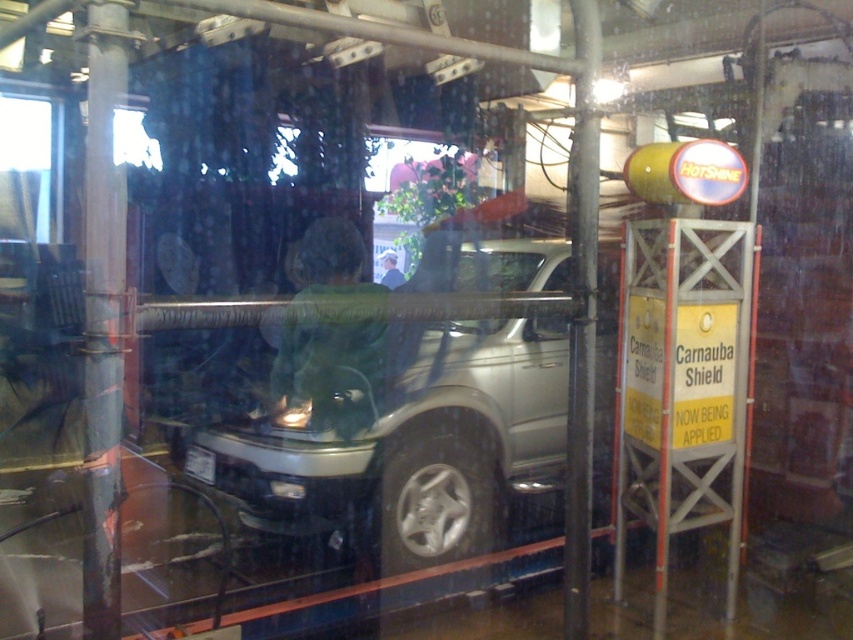
You are a delivery person with a box that is 4 meters long. You need to place the box between the green fabric shirt at center and the green fabric jacket at center. Is there enough space for the box to fit between them?

The distance between the green fabric shirt at center and the green fabric jacket at center is 3.86 meters. Since the box is 4 meters long, it is slightly too long to fit between them.

You are standing outside the car wash and looking through the fogged window. You see a satin silver vehicle at center and a green fabric jacket at center. Which object is closer to you through the window?

The satin silver vehicle at center is closer to you than the green fabric jacket at center because it is in front of it.

You are observing a car wash scene through a slightly fogged window. You notice two green fabric items at the center of the image. Which one is positioned lower between the green fabric shirt at center and the green fabric jacket at center?

The green fabric shirt at center is positioned below the green fabric jacket at center, so the shirt is lower.